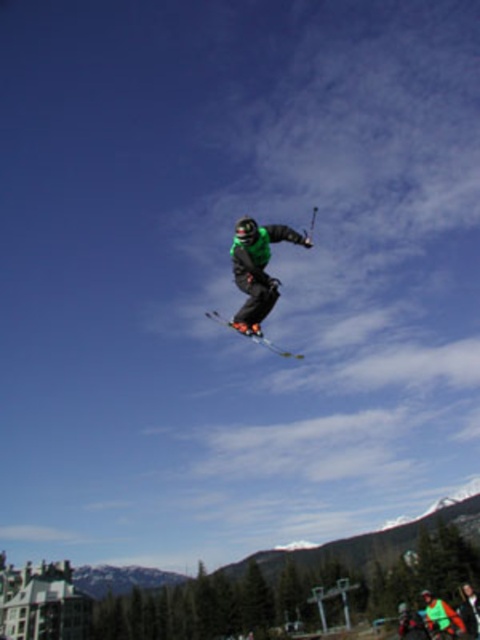
Question: Can you confirm if green matte snowboarder at center is thinner than shiny black skis at center?

Choices:
 (A) no
 (B) yes

Answer: (B)

Question: Is green matte snowboarder at center thinner than shiny black skis at center?

Choices:
 (A) no
 (B) yes

Answer: (B)

Question: Which point is closer to the camera?

Choices:
 (A) green matte snowboarder at center
 (B) shiny black skis at center

Answer: (A)

Question: Is green matte snowboarder at center positioned in front of shiny black skis at center?

Choices:
 (A) no
 (B) yes

Answer: (B)